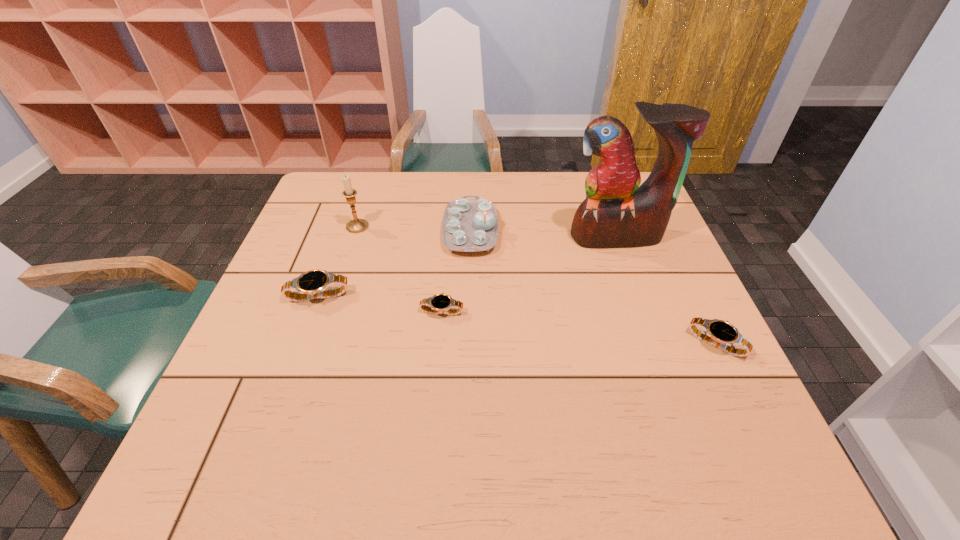
I want to click on free space for an extra watch to achieve even spacing, so click(x=574, y=327).